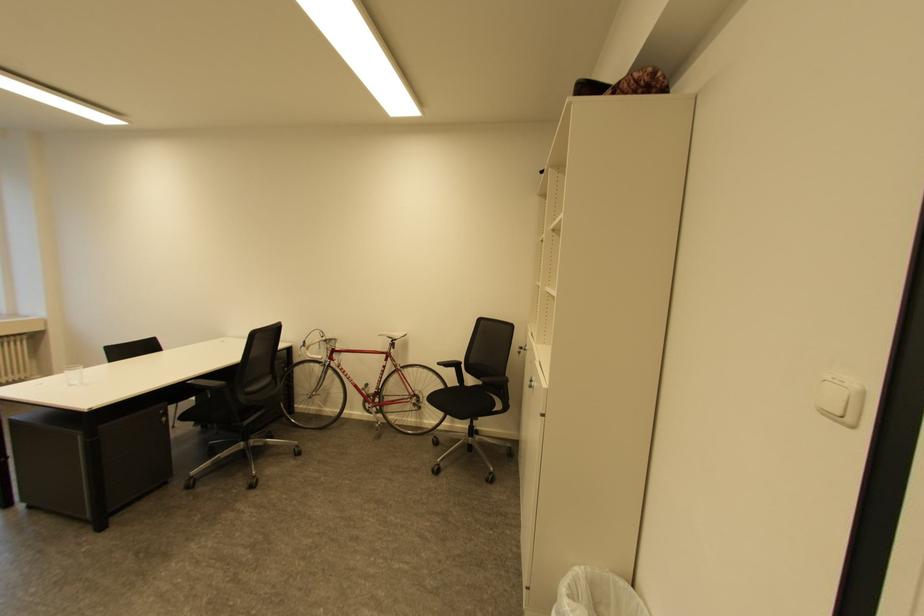
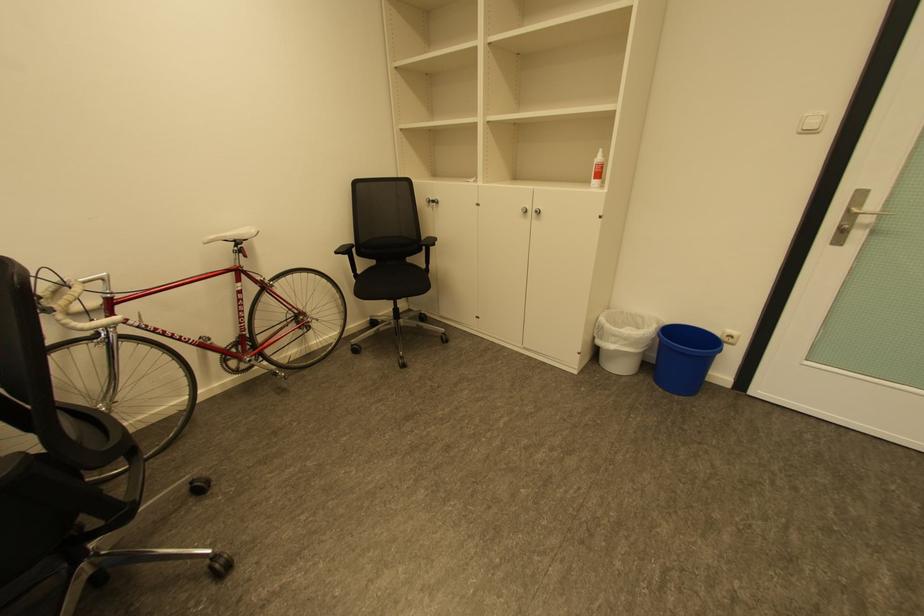
Find the pixel in the second image that matches point (312, 353) in the first image.

(70, 326)